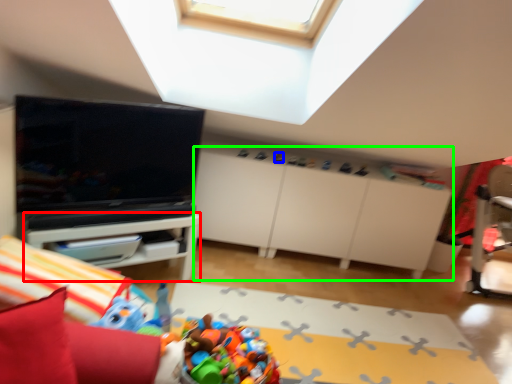
Question: Which is farther away from table (highlighted by a red box)? toy (highlighted by a blue box) or dresser (highlighted by a green box)?

Choices:
 (A) toy
 (B) dresser

Answer: (A)